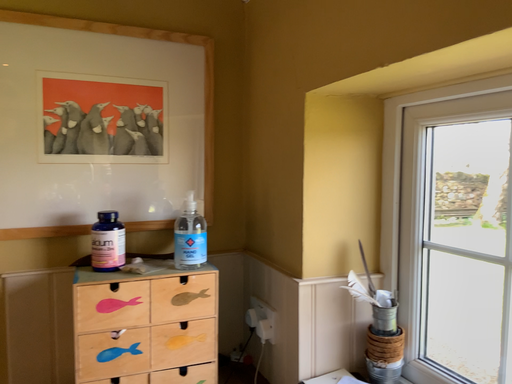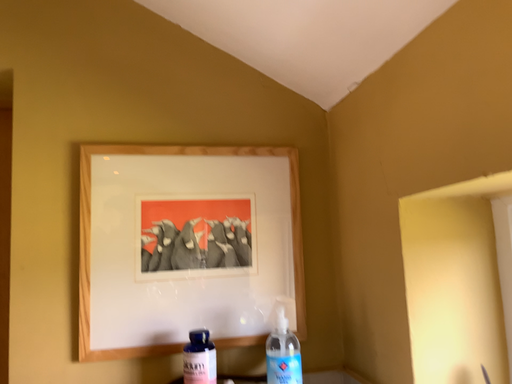
Question: Which way did the camera rotate in the video?

Choices:
 (A) rotated left
 (B) rotated right

Answer: (A)